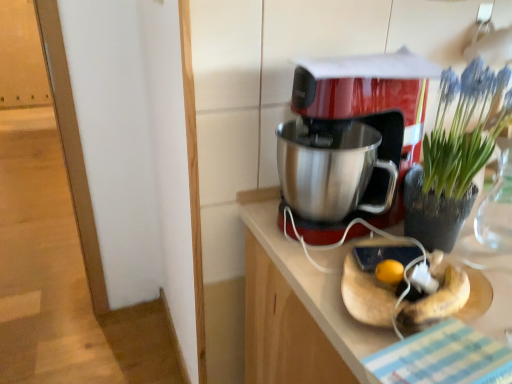
This screenshot has width=512, height=384. Find the location of `stainless steel countertop at center`. stainless steel countertop at center is located at coordinates (296, 309).

Image resolution: width=512 pixels, height=384 pixels. I want to click on green leafy plant at upper right, so click(x=453, y=157).

Find the location of a particular element. The image size is (512, 384). stainless steel countertop at center is located at coordinates (296, 309).

Considering the sizes of objects metallic red coffee maker at center and green leafy plant at upper right in the image provided, who is thinner, metallic red coffee maker at center or green leafy plant at upper right?

green leafy plant at upper right.

Does metallic red coffee maker at center appear on the right side of green leafy plant at upper right?

In fact, metallic red coffee maker at center is to the left of green leafy plant at upper right.

Is the position of metallic red coffee maker at center more distant than that of green leafy plant at upper right?

Yes, metallic red coffee maker at center is further from the camera.

I want to click on houseplant on the right of the metallic red coffee maker at center, so click(453, 157).

Based on the photo, is green leafy plant at upper right smaller than metallic red coffee maker at center?

Yes, green leafy plant at upper right is smaller than metallic red coffee maker at center.

From the image's perspective, is green leafy plant at upper right located above metallic red coffee maker at center?

No.

Which is in front, point (443, 209) or point (426, 75)?

Point (443, 209)

Does green leafy plant at upper right touch metallic red coffee maker at center?

There is a gap between green leafy plant at upper right and metallic red coffee maker at center.

Find the location of a particular element. The image size is (512, 384). coffee maker behind the stainless steel countertop at center is located at coordinates (352, 139).

From a real-world perspective, is metallic red coffee maker at center beneath stainless steel countertop at center?

No.

Considering the relative positions of metallic red coffee maker at center and stainless steel countertop at center in the image provided, is metallic red coffee maker at center in front of stainless steel countertop at center?

No, metallic red coffee maker at center is further to the viewer.

Is point (439, 174) farther from camera compared to point (324, 382)?

That is True.

Based on the photo, which of these two, green leafy plant at upper right or stainless steel countertop at center, is wider?

Wider between the two is stainless steel countertop at center.

Would you say green leafy plant at upper right is a long distance from stainless steel countertop at center?

That's not correct — green leafy plant at upper right is a little close to stainless steel countertop at center.

Is stainless steel countertop at center inside green leafy plant at upper right?

That's incorrect, stainless steel countertop at center is not inside green leafy plant at upper right.

Is stainless steel countertop at center not within green leafy plant at upper right?

Absolutely, stainless steel countertop at center is external to green leafy plant at upper right.

How many degrees apart are the facing directions of stainless steel countertop at center and green leafy plant at upper right?

The angle between the facing direction of stainless steel countertop at center and the facing direction of green leafy plant at upper right is 90 degrees.

From the image's perspective, is stainless steel countertop at center positioned above or below green leafy plant at upper right?

stainless steel countertop at center is situated lower than green leafy plant at upper right in the image.

Which object is positioned more to the right, stainless steel countertop at center or green leafy plant at upper right?

green leafy plant at upper right.

Is stainless steel countertop at center aimed at metallic red coffee maker at center?

No, stainless steel countertop at center is not facing towards metallic red coffee maker at center.

From the image's perspective, which one is positioned higher, stainless steel countertop at center or metallic red coffee maker at center?

metallic red coffee maker at center.

From a real-world perspective, is stainless steel countertop at center physically below metallic red coffee maker at center?

Yes, from a real-world perspective, stainless steel countertop at center is beneath metallic red coffee maker at center.

Find the location of a particular element. houseplant to the right of metallic red coffee maker at center is located at coordinates (453, 157).

Locate an element on the screen. coffee maker on the left of the green leafy plant at upper right is located at coordinates point(352,139).

Based on their spatial positions, is metallic red coffee maker at center or green leafy plant at upper right closer to stainless steel countertop at center?

metallic red coffee maker at center is positioned closer to the anchor stainless steel countertop at center.

From the image, which object appears to be nearer to stainless steel countertop at center, green leafy plant at upper right or metallic red coffee maker at center?

metallic red coffee maker at center lies closer to stainless steel countertop at center than the other object.

When comparing their distances from metallic red coffee maker at center, does green leafy plant at upper right or stainless steel countertop at center seem closer?

green leafy plant at upper right lies closer to metallic red coffee maker at center than the other object.

Looking at this image, considering their positions, is stainless steel countertop at center positioned further to metallic red coffee maker at center than green leafy plant at upper right?

stainless steel countertop at center lies further to metallic red coffee maker at center than the other object.

Based on their spatial positions, is metallic red coffee maker at center or stainless steel countertop at center further from green leafy plant at upper right?

The object further to green leafy plant at upper right is stainless steel countertop at center.

When comparing their distances from green leafy plant at upper right, does stainless steel countertop at center or metallic red coffee maker at center seem closer?

metallic red coffee maker at center is closer to green leafy plant at upper right.

Image resolution: width=512 pixels, height=384 pixels. What are the coordinates of `houseplant that lies between metallic red coffee maker at center and stainless steel countertop at center from top to bottom` in the screenshot? It's located at (453, 157).